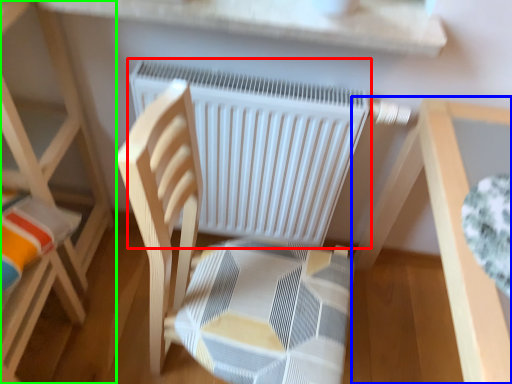
Question: Estimate the real-world distances between objects in this image. Which object is closer to radiator (highlighted by a red box), table (highlighted by a blue box) or furniture (highlighted by a green box)?

Choices:
 (A) table
 (B) furniture

Answer: (A)